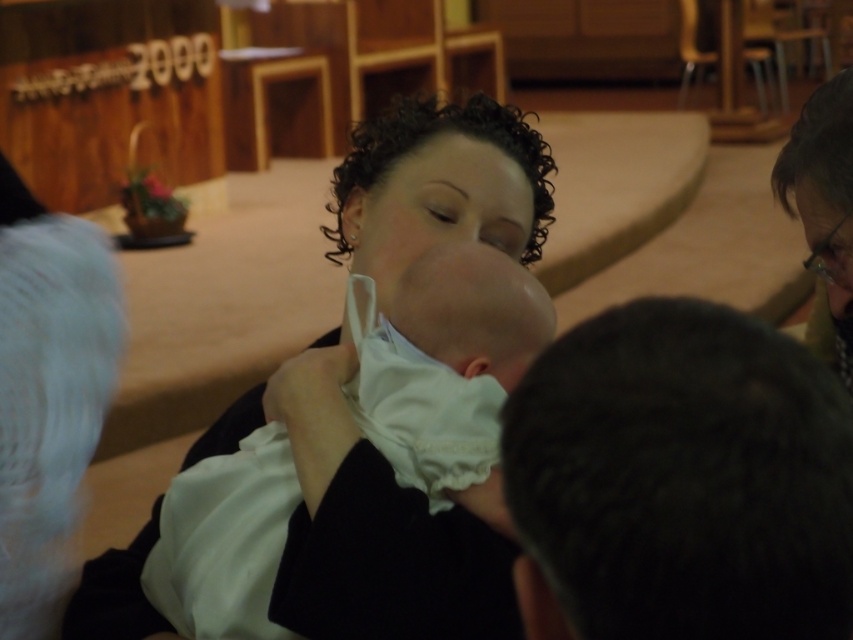
Question: Which object is farther from the camera taking this photo?

Choices:
 (A) dark hair at lower right
 (B) white clothed baby at center

Answer: (B)

Question: Can you confirm if dark hair at lower right is wider than white clothed baby at center?

Choices:
 (A) yes
 (B) no

Answer: (B)

Question: Where is dark hair at lower right located in relation to white clothed baby at center in the image?

Choices:
 (A) below
 (B) above

Answer: (B)

Question: Can you confirm if dark hair at lower right is thinner than white clothed baby at center?

Choices:
 (A) yes
 (B) no

Answer: (A)